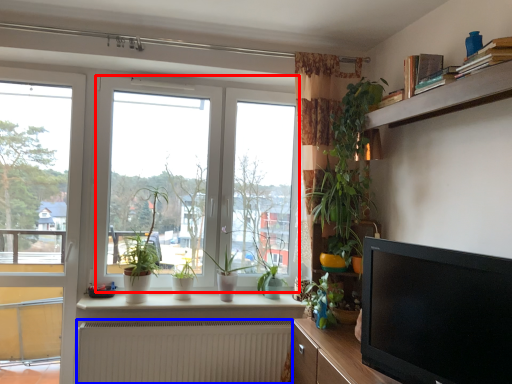
Question: Among these objects, which one is nearest to the camera, window (highlighted by a red box) or radiator (highlighted by a blue box)?

Choices:
 (A) window
 (B) radiator

Answer: (B)